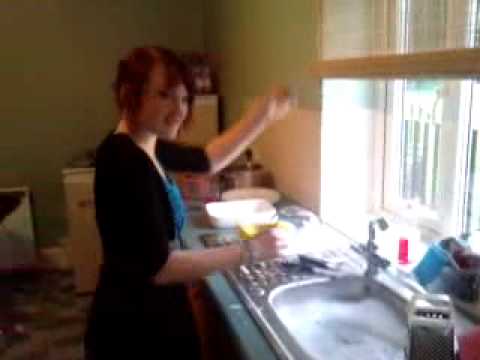
Identify the location of walls. (90, 88), (264, 35).